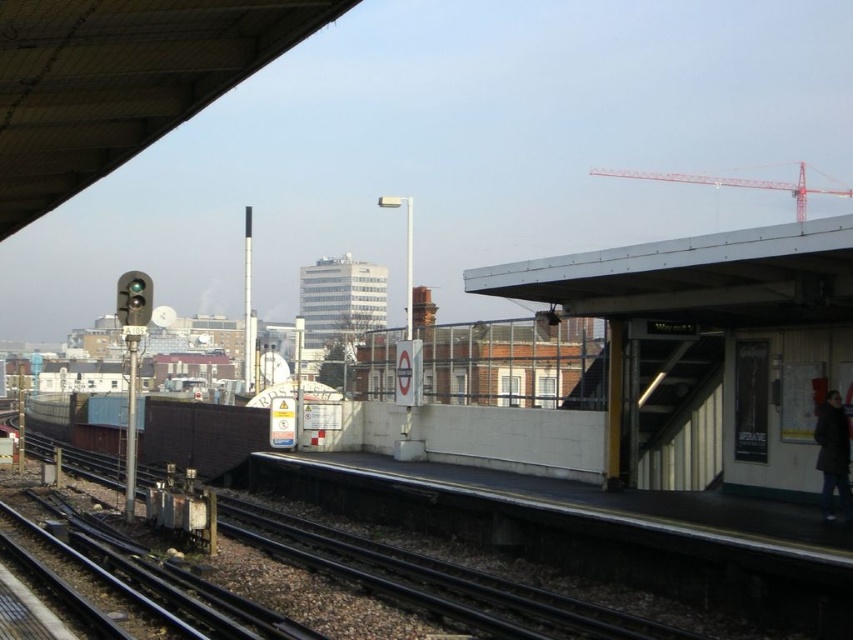
You are a commuter waiting at the train station platform. You notice a black metal track at lower left and a dark gray wool coat at right. Which object is located to the left of the other?

The black metal track at lower left is positioned on the left side of dark gray wool coat at right.

You are a commuter waiting at the train station platform. You notice a black metal track at lower left and a dark gray wool coat at right. Which object is wider when comparing their widths?

The black metal track at lower left is wider than the dark gray wool coat at right according to the description.